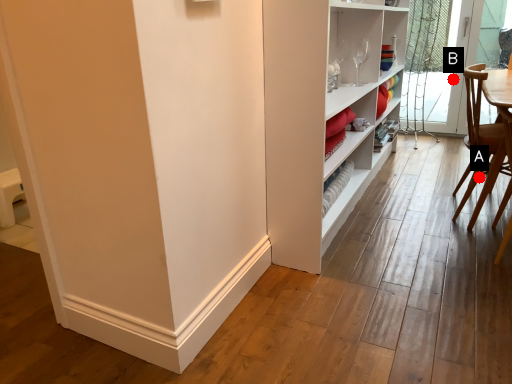
Question: Two points are circled on the image, labeled by A and B beside each circle. Which of the following is the closest to the observer?

Choices:
 (A) A is closer
 (B) B is closer

Answer: (A)